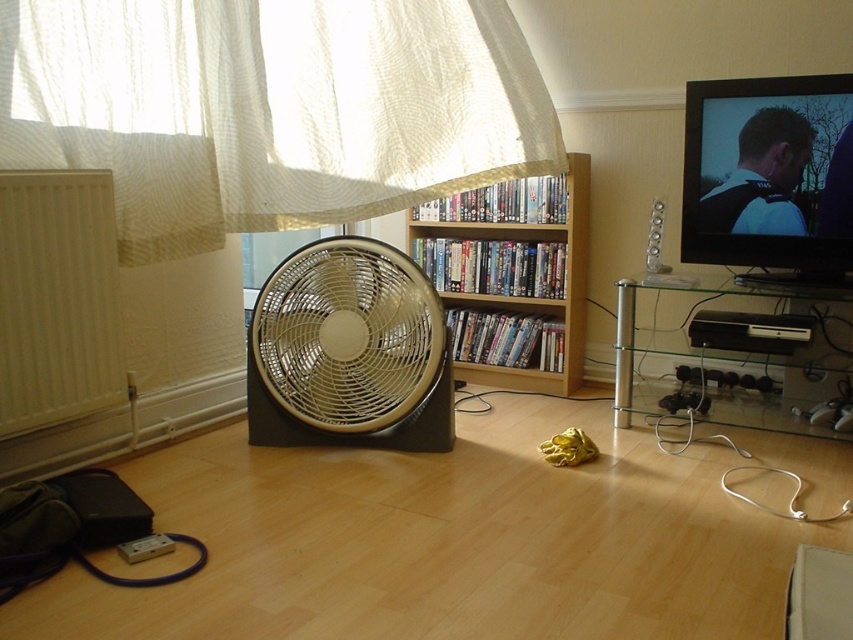
You are setting up a new plant on a shelf in this living room. The plant needs to be placed where it can receive indirect sunlight and not be directly under any heavy objects. Given the positions of the matte silver fan at center and the black plastic speaker at right, where should you place the plant?

The matte silver fan at center is positioned under the black plastic speaker at right, so placing the plant on a shelf above both objects would ensure it gets indirect sunlight and isn

You are trying to decide whether to place a new piece of artwork between the white sheer curtain at upper left and the black plastic speaker at right. Based on their widths, which object should you position the artwork closer to if you want it centered between them?

The white sheer curtain at upper left is wider than the black plastic speaker at right. To center the artwork between them, position it closer to the narrower object, which is the black plastic speaker at right, since the curtain takes up more horizontal space.

You are standing in the living room and want to take a photo of the two points mentioned. Which point, point (21, 372) or point (587, 172), will appear larger in your camera view?

Point (21, 372) is closer to the camera than point (587, 172), so it will appear larger in the camera view.